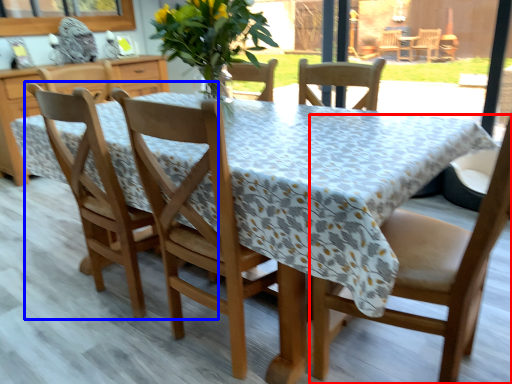
Question: Which object appears closest to the camera in this image, chair (highlighted by a red box) or chair (highlighted by a blue box)?

Choices:
 (A) chair
 (B) chair

Answer: (A)